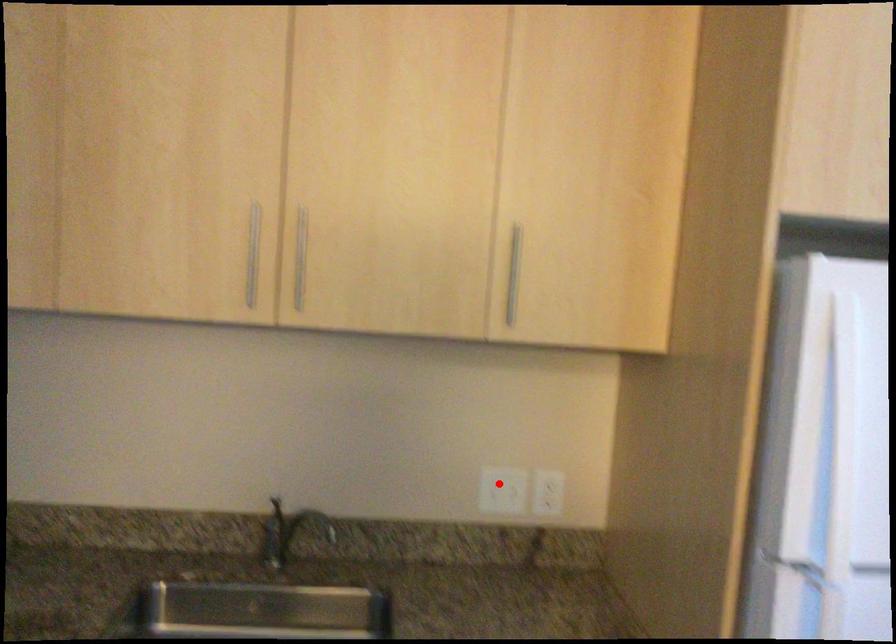
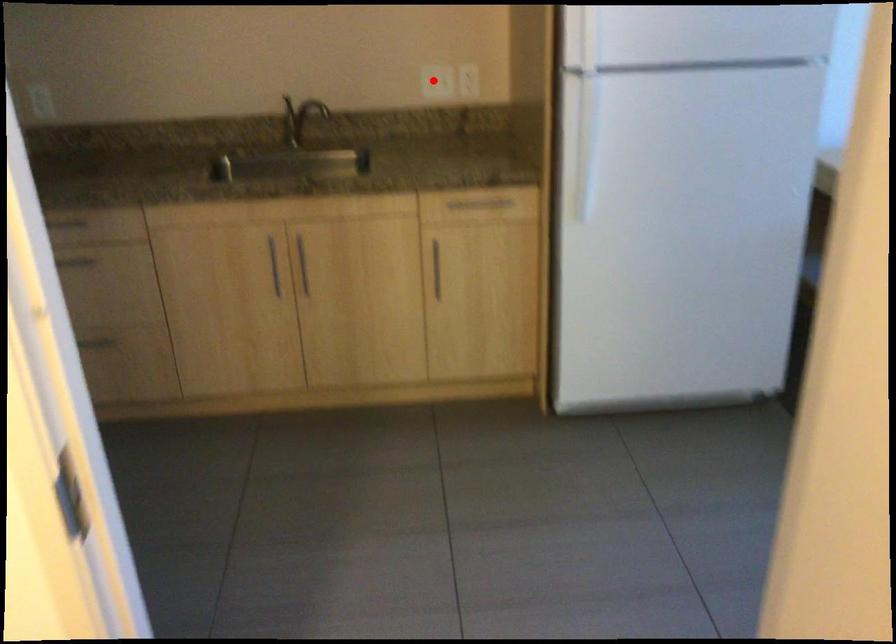
I am providing you with two images of the same scene from different viewpoints. A red point is marked on the first image and another point is marked on the second image. Is the marked point in image1 the same physical position as the marked point in image2?

Yes